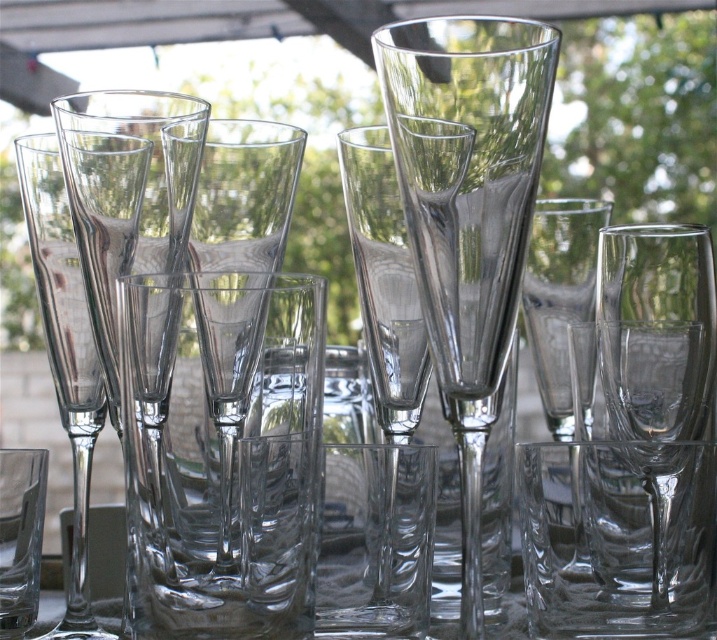
Does transparent glass wine glass at center appear on the right side of transparent glass wine glass at left?

Correct, you'll find transparent glass wine glass at center to the right of transparent glass wine glass at left.

Identify the location of transparent glass wine glass at center. This screenshot has height=640, width=717. (660, 380).

Find the location of a particular element. This screenshot has height=640, width=717. transparent glass wine glass at center is located at coordinates (660, 380).

Is transparent glass wine glass at left smaller than transparent glass flute at left?

No, transparent glass wine glass at left is not smaller than transparent glass flute at left.

Between transparent glass wine glass at left and transparent glass flute at left, which one is positioned higher?

Positioned higher is transparent glass wine glass at left.

What do you see at coordinates (125, 196) in the screenshot?
I see `transparent glass wine glass at left` at bounding box center [125, 196].

Locate an element on the screen. The height and width of the screenshot is (640, 717). transparent glass wine glass at left is located at coordinates (125, 196).

Which is more to the right, transparent glass vase at center or transparent glass wine glass at center?

transparent glass wine glass at center is more to the right.

Which is in front, point (521, 99) or point (660, 465)?

Point (521, 99) is in front.

Which is in front, point (474, 481) or point (617, 305)?

Point (474, 481) is more forward.

I want to click on transparent glass vase at center, so click(x=467, y=211).